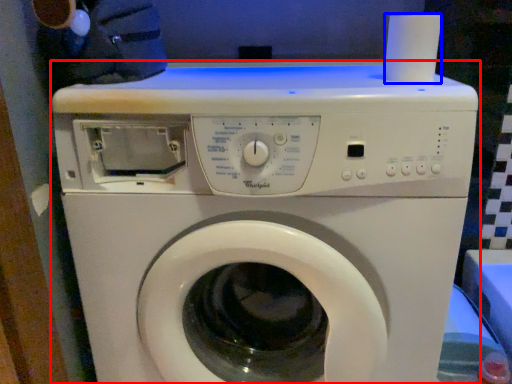
Question: Which of the following is the farthest to the observer, washing machine (highlighted by a red box) or paper towel (highlighted by a blue box)?

Choices:
 (A) washing machine
 (B) paper towel

Answer: (B)